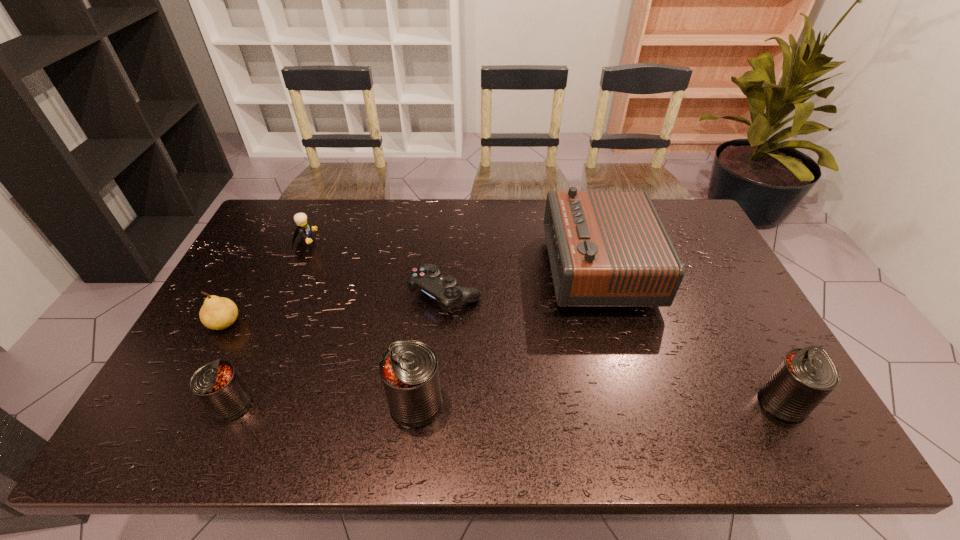
Where is `vacant space at the far right corner of the desktop`? vacant space at the far right corner of the desktop is located at coordinates 663,224.

The width and height of the screenshot is (960, 540). I want to click on vacant area that lies between the rightmost object and the second object from right to left, so [x=690, y=335].

The width and height of the screenshot is (960, 540). Find the location of `free space between the Lego and the pear`. free space between the Lego and the pear is located at coordinates (266, 283).

The width and height of the screenshot is (960, 540). I want to click on unoccupied position between the rightmost can and the second can from right to left, so click(599, 403).

Identify the location of free space that is in between the radio receiver and the shortest object. The width and height of the screenshot is (960, 540). (521, 281).

The width and height of the screenshot is (960, 540). Find the location of `vacant area that lies between the pear and the second tallest can`. vacant area that lies between the pear and the second tallest can is located at coordinates (504, 363).

Where is `blank region between the Lego and the second object from right to left`? The image size is (960, 540). blank region between the Lego and the second object from right to left is located at coordinates (452, 255).

Find the location of `vacant space that is in between the second can from left to right and the second shortest can`. vacant space that is in between the second can from left to right and the second shortest can is located at coordinates (599, 403).

Locate an element on the screen. The height and width of the screenshot is (540, 960). vacant area that lies between the Lego and the control is located at coordinates (376, 268).

This screenshot has width=960, height=540. Identify the location of vacant space that is in between the leftmost object and the second can from left to right. (321, 364).